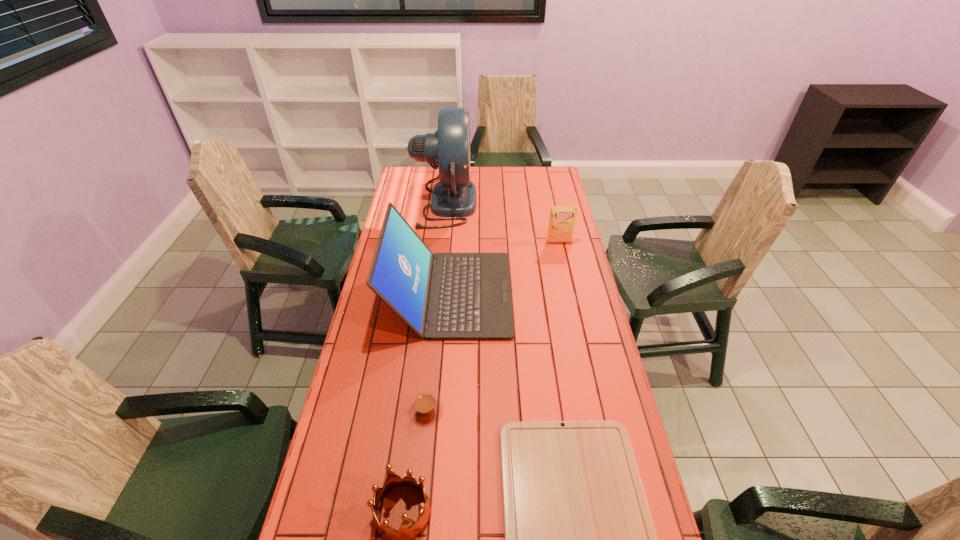
Identify the location of vacant space at the far right corner of the desktop. point(557,176).

The image size is (960, 540). Find the location of `free space between the cappuccino and the second tallest object`. free space between the cappuccino and the second tallest object is located at coordinates (438, 353).

This screenshot has height=540, width=960. What are the coordinates of `object that is the third closest to the fifth shortest object` in the screenshot? It's located at (426, 409).

Locate which object is the closest to the tallest object. Please provide its 2D coordinates. Your answer should be formatted as a tuple, i.e. [(x, y)], where the tuple contains the x and y coordinates of a point satisfying the conditions above.

[(444, 296)]